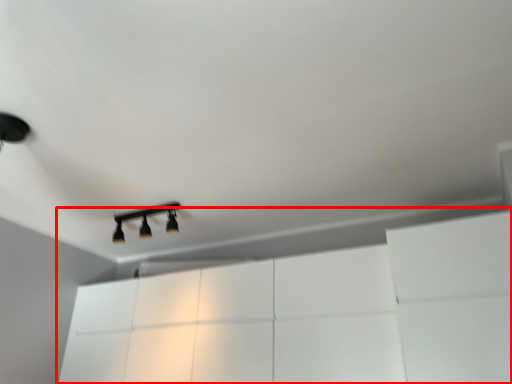
Question: From the image's perspective, where is dresser (annotated by the red box) located in relation to lamp in the image?

Choices:
 (A) below
 (B) above

Answer: (A)